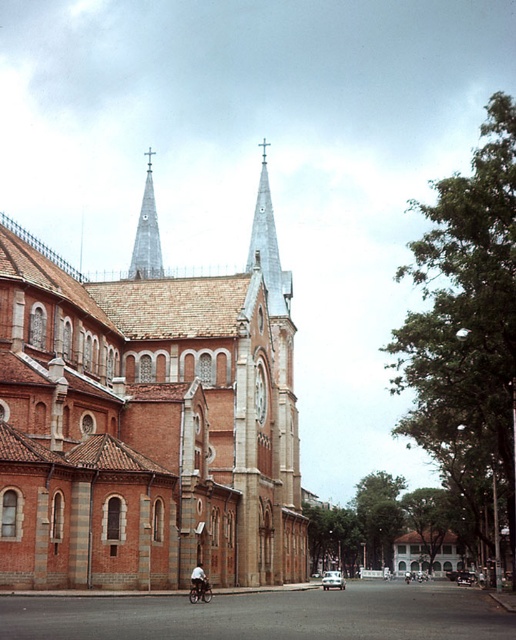
You are a tourist standing on the street looking at the church. You notice the shiny silver spire at upper center and the dark blue fabric shirt at lower center. Which object is larger in size?

The shiny silver spire at upper center is bigger than the dark blue fabric shirt at lower center.